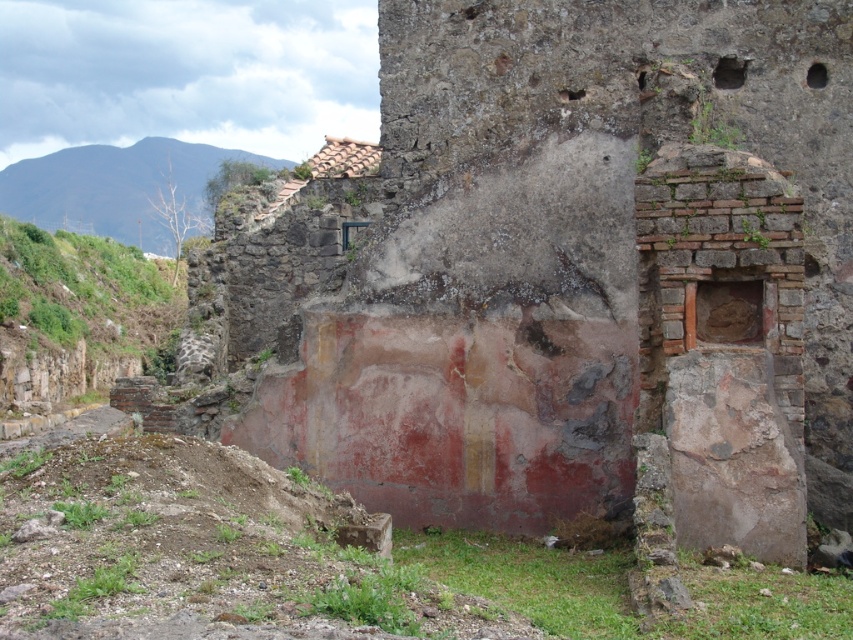
Question: Which point is farther to the camera?

Choices:
 (A) green grassy hillside at upper left
 (B) green grassy hillside at left

Answer: (A)

Question: Is green grassy hillside at left below green grassy hillside at upper left?

Choices:
 (A) no
 (B) yes

Answer: (B)

Question: Is reddish-brown stone wall at center further to the viewer compared to green grassy hillside at upper left?

Choices:
 (A) no
 (B) yes

Answer: (A)

Question: Which point is farther to the camera?

Choices:
 (A) reddish-brown stone wall at center
 (B) green grassy hillside at left
 (C) green grassy hillside at upper left

Answer: (C)

Question: Which of the following is the farthest from the observer?

Choices:
 (A) green grassy hillside at upper left
 (B) green grassy hillside at left
 (C) reddish-brown stone wall at center

Answer: (A)

Question: Is reddish-brown stone wall at center wider than green grassy hillside at left?

Choices:
 (A) yes
 (B) no

Answer: (A)